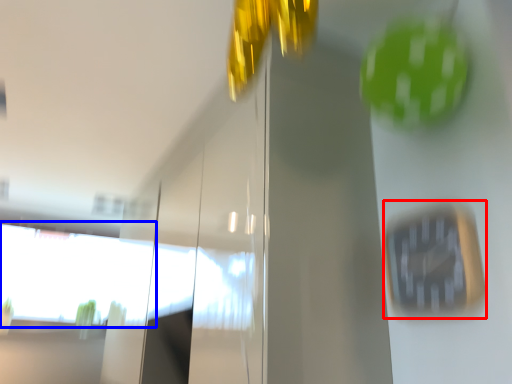
Question: Which object is closer to the camera taking this photo, clock (highlighted by a red box) or window (highlighted by a blue box)?

Choices:
 (A) clock
 (B) window

Answer: (A)